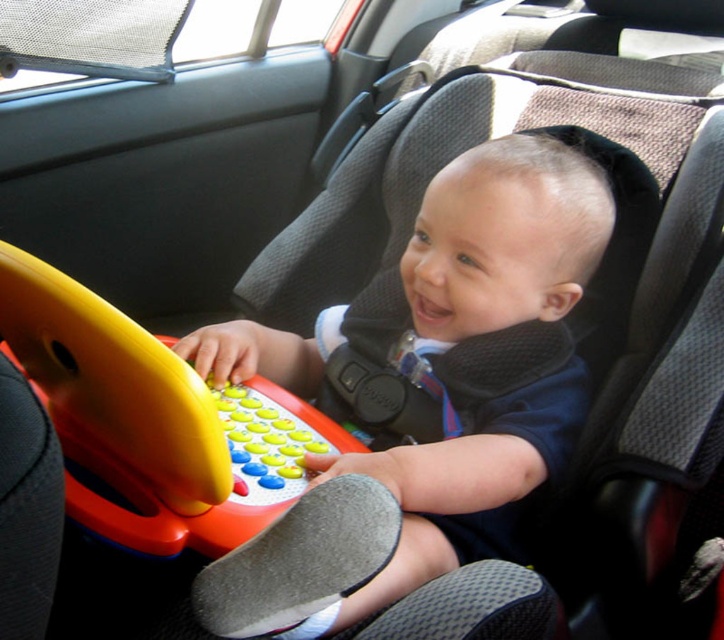
Does matte plastic toy at center have a greater height compared to rubberized plastic toy at center?

Yes.

Can you confirm if matte plastic toy at center is smaller than rubberized plastic toy at center?

Incorrect, matte plastic toy at center is not smaller in size than rubberized plastic toy at center.

Where is `matte plastic toy at center`? This screenshot has height=640, width=724. matte plastic toy at center is located at coordinates (425, 397).